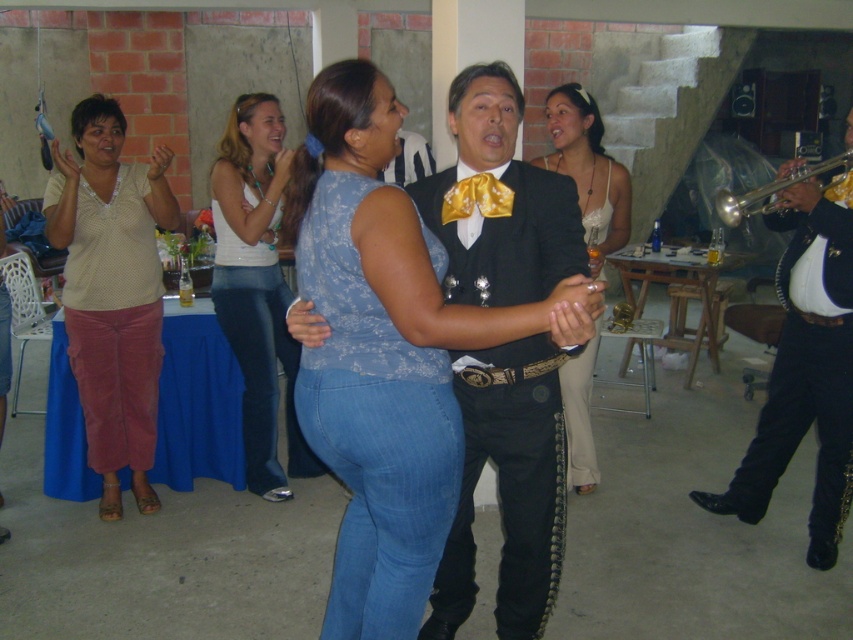
Question: Which of the following is the closest to the observer?

Choices:
 (A) shiny black pants at right
 (B) blue denim jeans at center
 (C) matte beige blouse at left

Answer: (B)

Question: Is matte beige blouse at left above white denim jeans at center?

Choices:
 (A) no
 (B) yes

Answer: (A)

Question: Among these points, which one is farthest from the camera?

Choices:
 (A) (805, 177)
 (B) (256, 96)
 (C) (73, 356)
 (D) (813, 346)

Answer: (B)

Question: Does matte beige blouse at left lie behind gold metallic trumpet at right?

Choices:
 (A) yes
 (B) no

Answer: (A)

Question: Is shiny black pants at right closer to the viewer compared to gold metallic trumpet at right?

Choices:
 (A) no
 (B) yes

Answer: (B)

Question: Which point is farther from the camera taking this photo?

Choices:
 (A) (287, 497)
 (B) (793, 358)
 (C) (300, 304)
 (D) (579, 156)

Answer: (A)